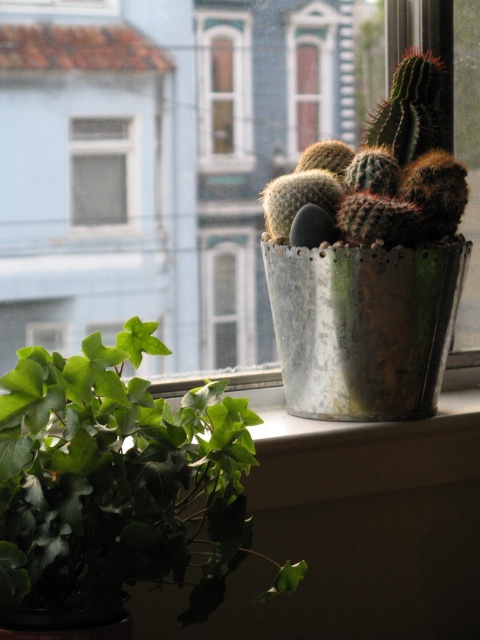
Question: Which is nearer to the transparent glass window at upper center?

Choices:
 (A) green matte ivy at center
 (B) green glass window at upper center
 (C) white glass window at upper left

Answer: (B)

Question: Can you confirm if green glass window at upper center is thinner than white glass window at upper left?

Choices:
 (A) yes
 (B) no

Answer: (A)

Question: Can you confirm if green glass window at upper center is smaller than white glass window at upper left?

Choices:
 (A) no
 (B) yes

Answer: (A)

Question: Is green glass window at upper center smaller than white glass window at upper left?

Choices:
 (A) yes
 (B) no

Answer: (B)

Question: Estimate the real-world distances between objects in this image. Which object is closer to the white glass window at upper left?

Choices:
 (A) green matte ivy at center
 (B) transparent glass window at upper center

Answer: (B)

Question: Which object is closer to the camera taking this photo?

Choices:
 (A) transparent glass window at upper center
 (B) green matte ivy at center
 (C) green glass window at upper center

Answer: (B)